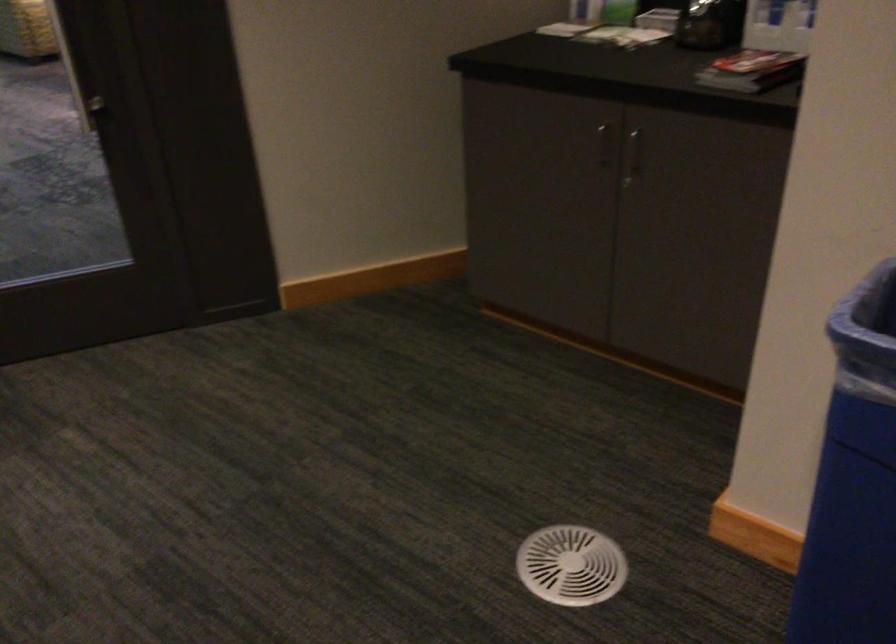
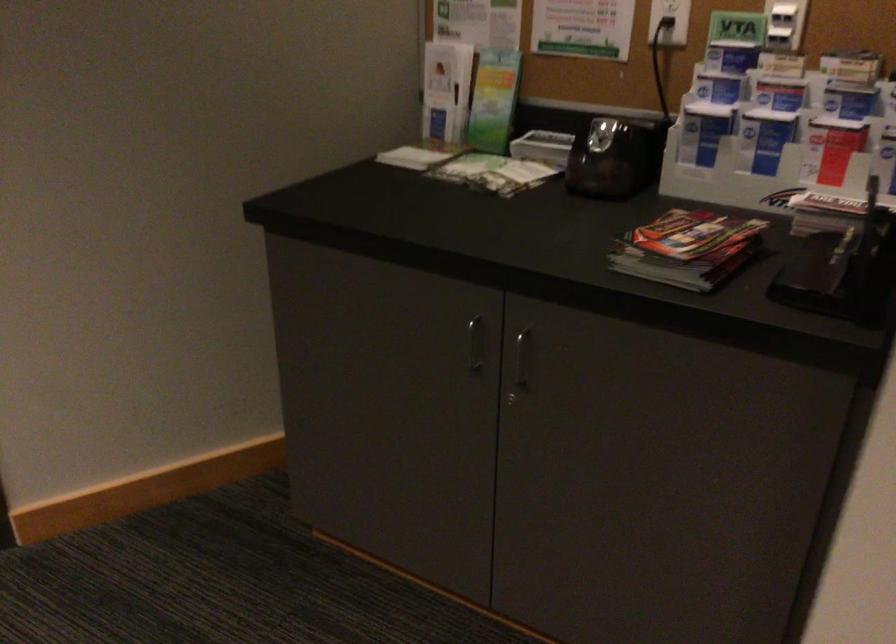
Locate, in the second image, the point that corresponds to point 633,149 in the first image.

(521, 357)